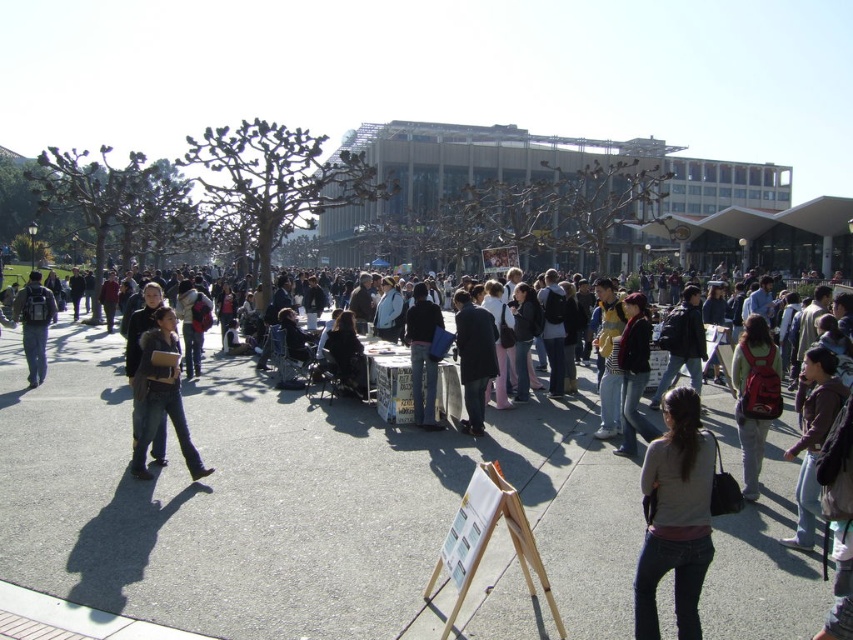
Can you confirm if dark gray jeans at center is taller than matte black backpack at left?

No.

Does point (135, 465) lie in front of point (30, 368)?

That is True.

Between point (143, 368) and point (54, 317), which one is positioned behind?

The point (54, 317) is more distant.

Find the location of a particular element. This screenshot has width=853, height=640. dark gray jeans at center is located at coordinates (161, 396).

Looking at this image, can you confirm if dark brown leather jacket at lower right is thinner than matte black backpack at left?

Yes, dark brown leather jacket at lower right is thinner than matte black backpack at left.

Which is in front, point (838, 410) or point (28, 330)?

Point (838, 410) is more forward.

Does point (807, 400) come behind point (35, 317)?

No, it is in front of (35, 317).

Image resolution: width=853 pixels, height=640 pixels. Find the location of `dark brown leather jacket at lower right`. dark brown leather jacket at lower right is located at coordinates point(813,435).

In the scene shown: How distant is dark gray backpack at center from dark gray jeans at center?

The distance of dark gray backpack at center from dark gray jeans at center is 7.29 feet.

What do you see at coordinates (288, 504) in the screenshot? This screenshot has width=853, height=640. I see `dark gray backpack at center` at bounding box center [288, 504].

You are a GUI agent. You are given a task and a screenshot of the screen. Output one action in this format:
    pyautogui.click(x=<x>, y=<y>)
    Task: Click on the dark gray backpack at center
    
    Given the screenshot: What is the action you would take?
    pyautogui.click(x=288, y=504)